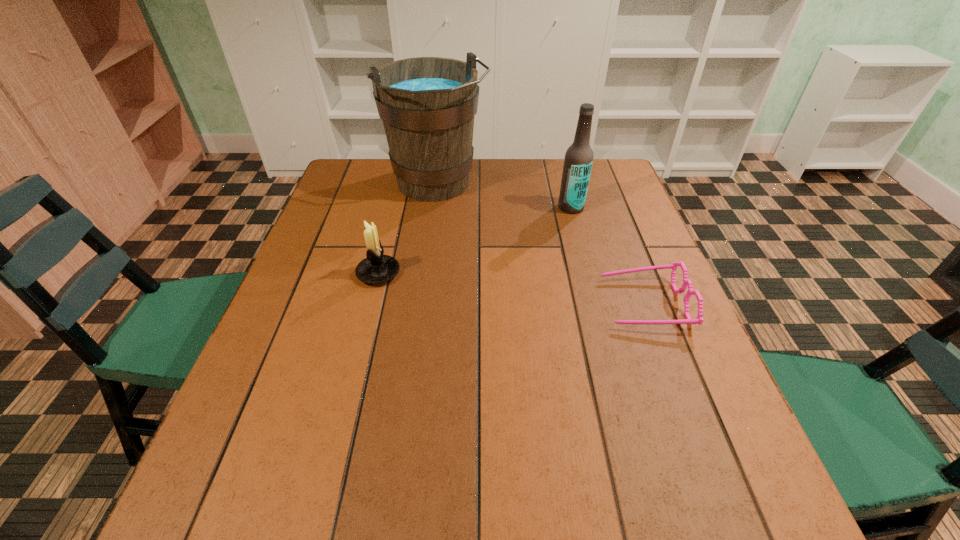
You are a GUI agent. You are given a task and a screenshot of the screen. Output one action in this format:
    pyautogui.click(x=<x>, y=<y>)
    Task: Click on the candle holder
    Image resolution: width=960 pixels, height=540 pixels.
    Given the screenshot: What is the action you would take?
    pyautogui.click(x=377, y=268)

The width and height of the screenshot is (960, 540). What are the coordinates of `the shortest object` in the screenshot? It's located at (699, 319).

Find the location of a particular element. The width and height of the screenshot is (960, 540). wine bucket is located at coordinates (427, 104).

The height and width of the screenshot is (540, 960). Identify the location of beer bottle. (578, 160).

What are the coordinates of `free space located on the right of the second shortest object` in the screenshot? It's located at (424, 273).

This screenshot has width=960, height=540. I want to click on blank space located on the arms of the shortest object, so tap(487, 303).

Where is `free space located on the arms of the shortest object`? free space located on the arms of the shortest object is located at coordinates (584, 303).

This screenshot has height=540, width=960. I want to click on vacant area situated on the arms of the shortest object, so (570, 303).

Find the location of `vacant space located with a handle on the side of the wine bucket`. vacant space located with a handle on the side of the wine bucket is located at coordinates (478, 237).

I want to click on vacant space located 0.270m with a handle on the side of the wine bucket, so click(x=502, y=268).